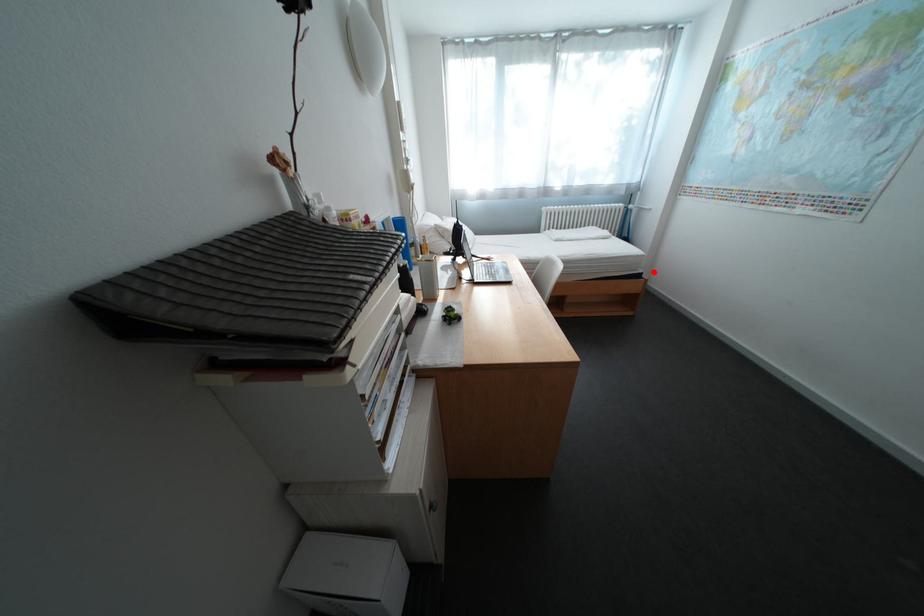
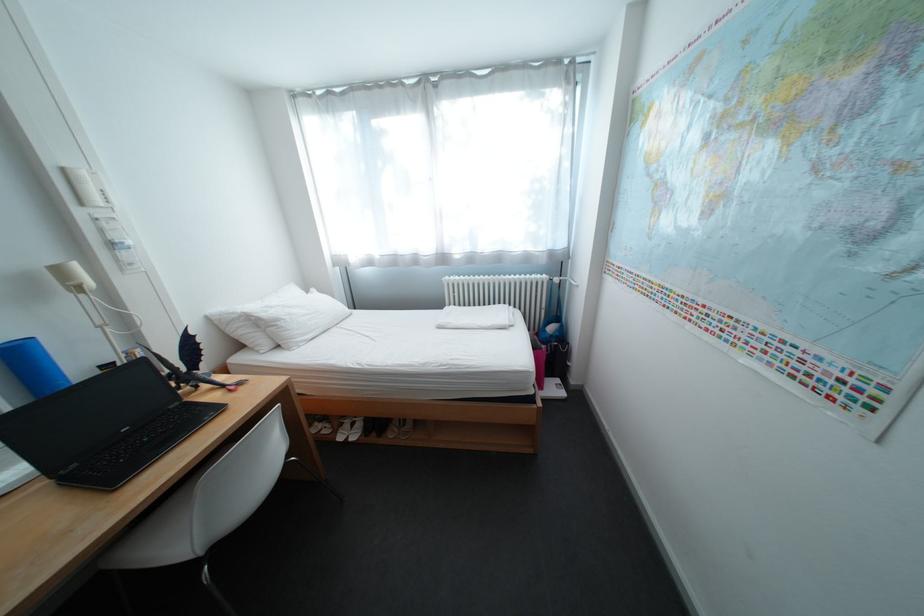
In the second image, find the point that corresponds to the highlighted location in the first image.

(544, 392)